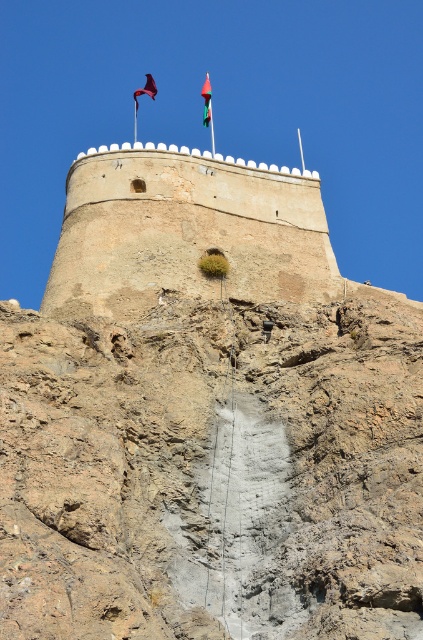
Which of these two, red fabric flag at upper center or silky purple flag at upper center, stands shorter?

With less height is silky purple flag at upper center.

Between red fabric flag at upper center and silky purple flag at upper center, which one is positioned higher?

Positioned higher is silky purple flag at upper center.

Is point (206, 112) closer to viewer compared to point (151, 88)?

Yes, point (206, 112) is closer to viewer.

Where is `red fabric flag at upper center`? The image size is (423, 640). red fabric flag at upper center is located at coordinates (206, 100).

Can you confirm if brown stone tower at upper center is positioned to the right of silky purple flag at upper center?

Yes, brown stone tower at upper center is to the right of silky purple flag at upper center.

Based on the photo, between brown stone tower at upper center and silky purple flag at upper center, which one appears on the right side from the viewer's perspective?

Positioned to the right is brown stone tower at upper center.

This screenshot has width=423, height=640. What are the coordinates of `brown stone tower at upper center` in the screenshot? It's located at (186, 230).

Between brown stone tower at upper center and red fabric flag at upper center, which one is positioned lower?

brown stone tower at upper center is below.

Measure the distance between brown stone tower at upper center and red fabric flag at upper center.

brown stone tower at upper center is 169.39 meters away from red fabric flag at upper center.

Identify the location of brown stone tower at upper center. (186, 230).